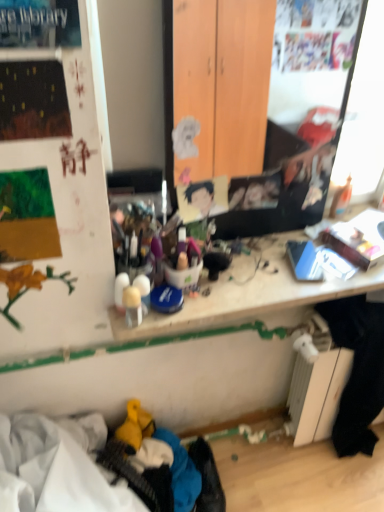
Find the location of a particular element. Image resolution: width=384 pixels, height=512 pixels. empty space that is ontop of wooden desk at center is located at coordinates pos(272,258).